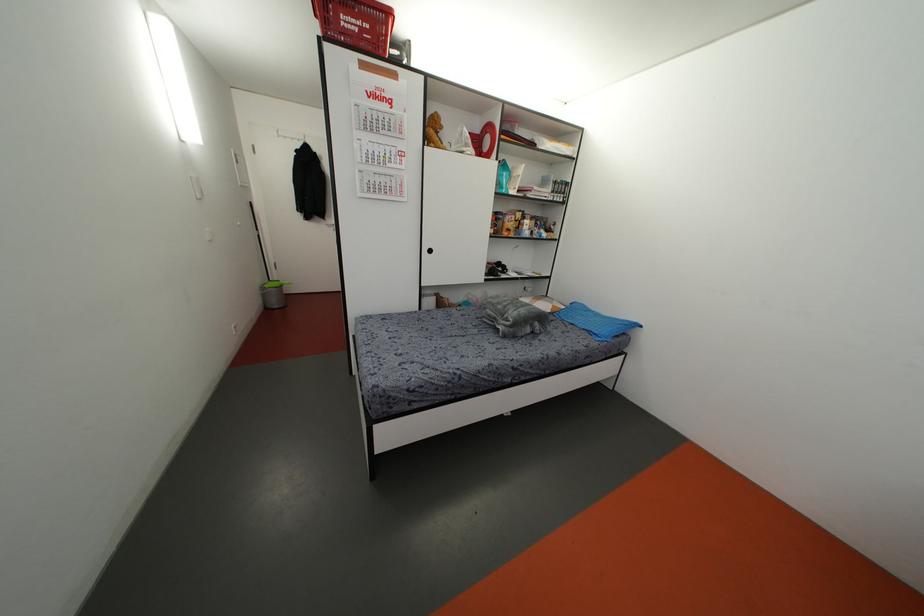
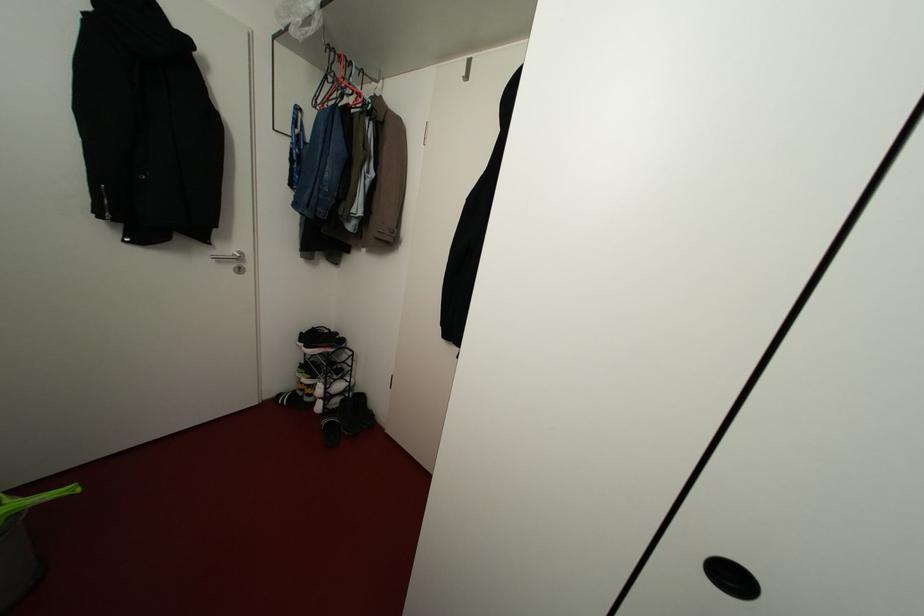
From the picture: What movement of the cameraman would produce the second image?

The cameraman walked toward left, forward.